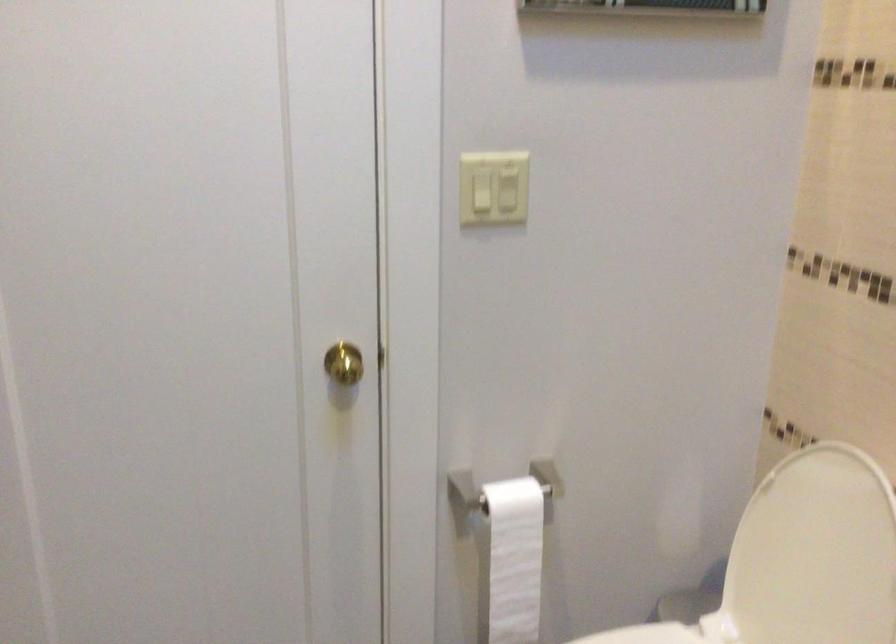
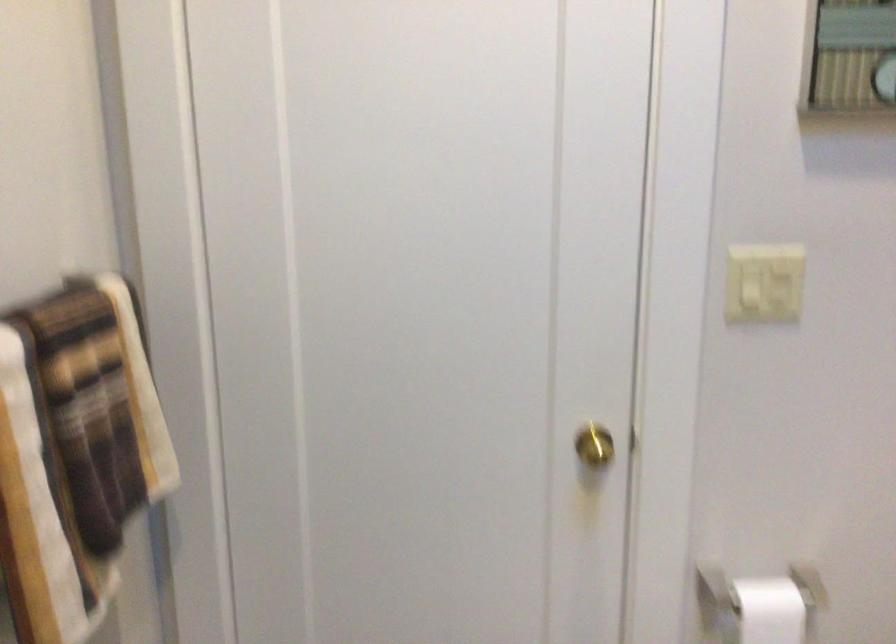
Question: The images are taken continuously from a first-person perspective. In which direction is your viewpoint rotating?

Choices:
 (A) Left
 (B) Right
 (C) Up
 (D) Down

Answer: (A)